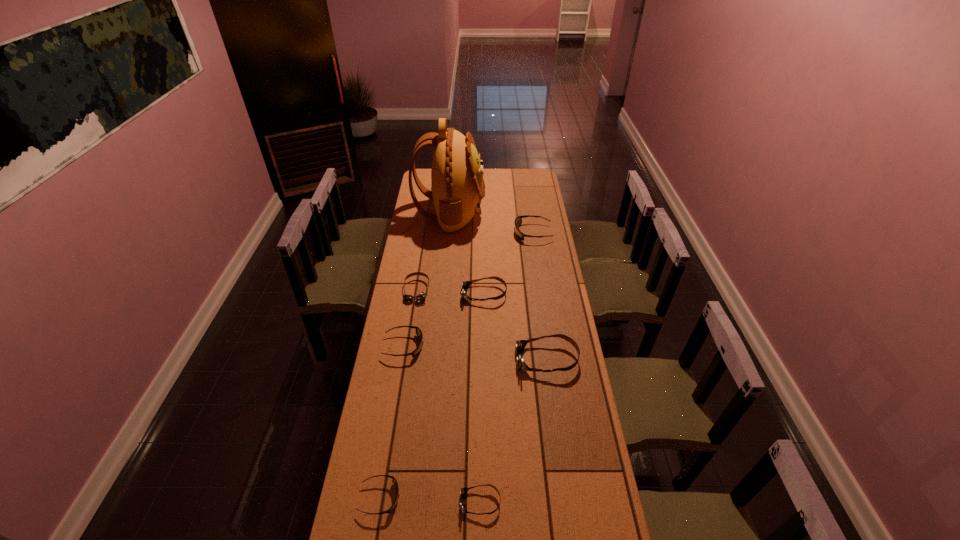
The image size is (960, 540). Identify the location of the nearest brown goggles. (464, 490).

Where is `blank area located 0.350m on the front-facing side of the tallest object`? blank area located 0.350m on the front-facing side of the tallest object is located at coordinates (544, 212).

Image resolution: width=960 pixels, height=540 pixels. Find the location of `free spot located on the front-facing side of the second tallest object`. free spot located on the front-facing side of the second tallest object is located at coordinates point(489,360).

Where is `free location located 0.160m on the front-facing side of the second tallest object`? free location located 0.160m on the front-facing side of the second tallest object is located at coordinates (476, 360).

This screenshot has width=960, height=540. What are the coordinates of `vacant area situated on the front-facing side of the second tallest object` in the screenshot? It's located at (498, 360).

The width and height of the screenshot is (960, 540). I want to click on vacant area situated 0.120m on the lenses of the rightmost black goggles, so click(492, 233).

The width and height of the screenshot is (960, 540). I want to click on free location located 0.290m on the lenses of the rightmost black goggles, so click(x=461, y=233).

The image size is (960, 540). What are the coordinates of `free region located on the lenses of the rightmost black goggles` in the screenshot? It's located at (489, 233).

In order to click on free space located 0.050m on the front-facing side of the third smallest brown goggles in this screenshot , I will do `click(451, 294)`.

I want to click on vacant space located on the front-facing side of the third smallest brown goggles, so click(x=421, y=294).